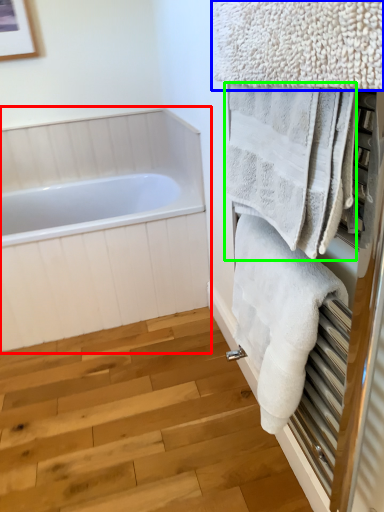
Question: Estimate the real-world distances between objects in this image. Which object is closer to bathtub (highlighted by a red box), towel (highlighted by a blue box) or towel (highlighted by a green box)?

Choices:
 (A) towel
 (B) towel

Answer: (B)